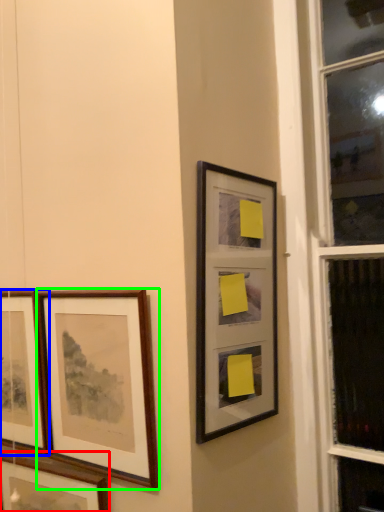
Question: Considering the real-world distances, which object is farthest from picture frame (highlighted by a red box)? picture frame (highlighted by a blue box) or picture frame (highlighted by a green box)?

Choices:
 (A) picture frame
 (B) picture frame

Answer: (B)